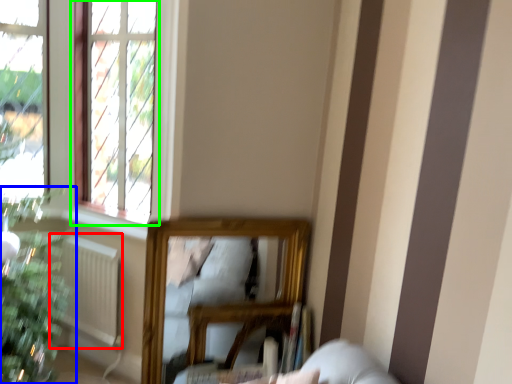
Question: Which object is the closest to the radiator (highlighted by a red box)? Choose among these: houseplant (highlighted by a blue box) or window (highlighted by a green box).

Choices:
 (A) houseplant
 (B) window

Answer: (A)